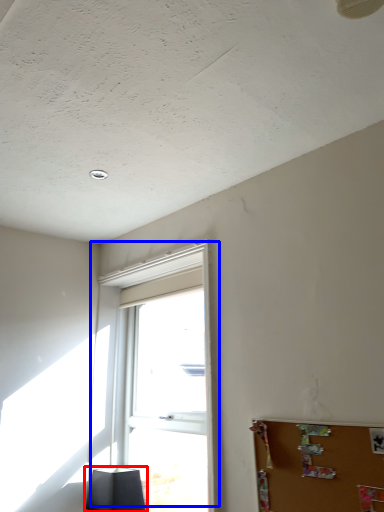
Question: Which object appears closest to the camera in this image, lamp (highlighted by a red box) or window (highlighted by a blue box)?

Choices:
 (A) lamp
 (B) window

Answer: (B)